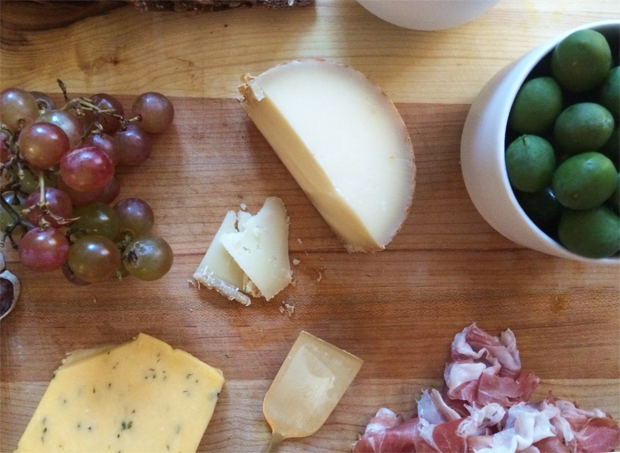
Identify the location of grey handle. (268, 443).